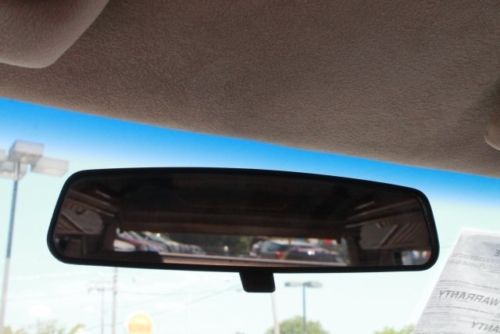
The height and width of the screenshot is (334, 500). I want to click on sticker, so click(467, 306).